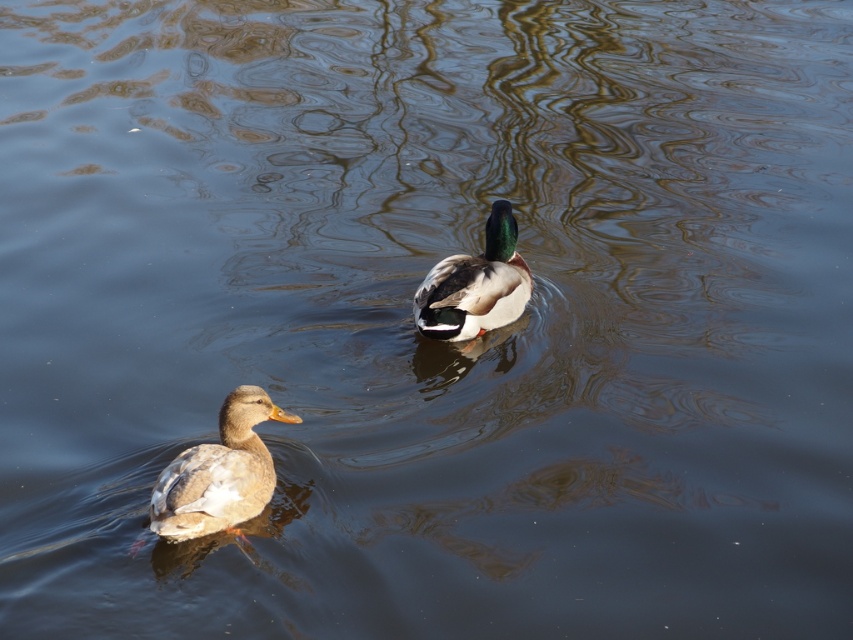
You are a photographer trying to capture both the brown feathered duck at lower left and the green glossy duck at center in a single shot. Based on their positions, which duck is closer to the left edge of the photo?

The brown feathered duck at lower left is closer to the left edge of the photo because it is positioned to the left of the green glossy duck at center.

You are standing at the origin point of the image coordinate system. The brown feathered duck at lower left is located at point 0.739, 0.258. If you want to throw a small pebble to hit the duck, in which direction should you aim relative to your current position?

The brown feathered duck at lower left is located at point (219, 472). To hit it, aim towards the coordinates (219, 472) from your current position at the origin.

You are a wildlife photographer aiming to capture the brown feathered duck at lower left and the green glossy duck at center in a single frame. Based on their positions, which duck would require you to zoom in more to include both in the frame?

The brown feathered duck at lower left is thinner than the green glossy duck at center, so the photographer would need to zoom in more to include both the brown feathered duck at lower left and the green glossy duck at center in the frame because the thinner duck might be farther away or require a closer focus to capture details.